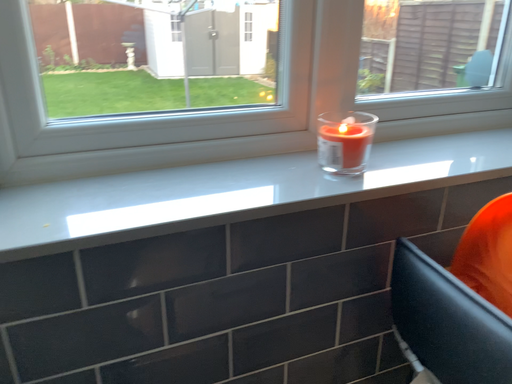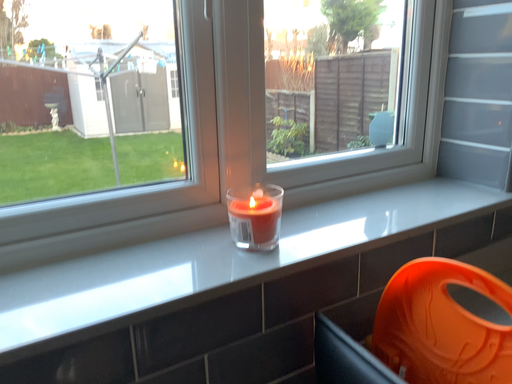
Question: How did the camera likely rotate when shooting the video?

Choices:
 (A) rotated left
 (B) rotated right

Answer: (B)